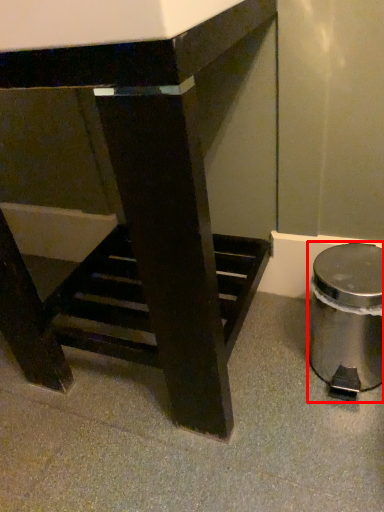
Question: From the image's perspective, where is waste container (annotated by the red box) located in relation to table in the image?

Choices:
 (A) above
 (B) below

Answer: (B)